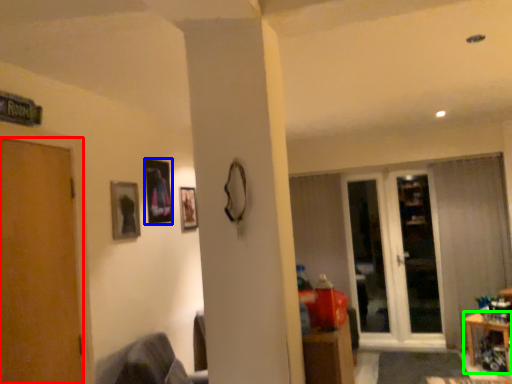
Question: Which is farther away from door (highlighted by a red box)? picture frame (highlighted by a blue box) or table (highlighted by a green box)?

Choices:
 (A) picture frame
 (B) table

Answer: (B)